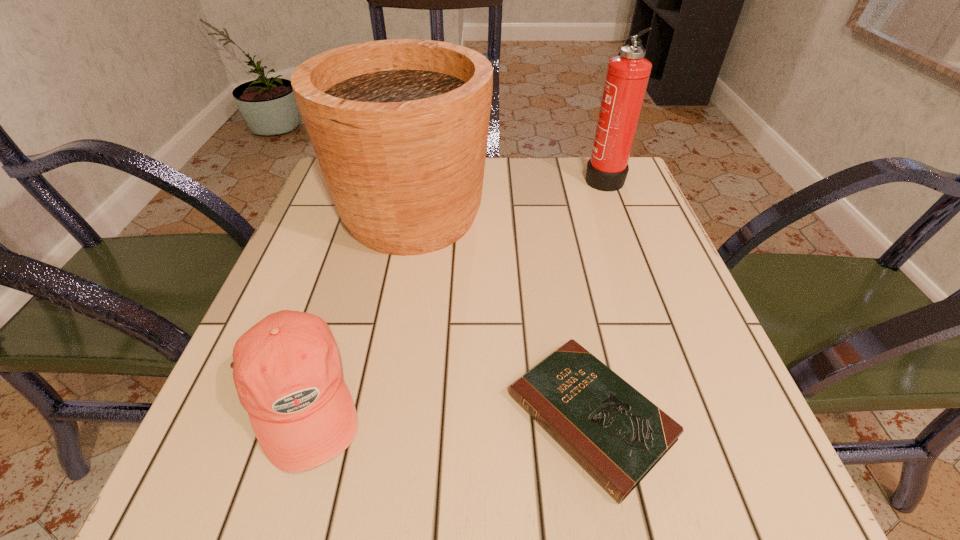
At what (x,y) coordinates should I click in order to perform the action: click on fire extinguisher that is at the far edge. Please return your answer as a coordinate pair (x, y). This screenshot has height=540, width=960. Looking at the image, I should click on (627, 76).

Where is `flowerpot that is at the far edge`? The width and height of the screenshot is (960, 540). flowerpot that is at the far edge is located at coordinates (400, 127).

I want to click on baseball cap situated at the near edge, so click(286, 368).

At what (x,y) coordinates should I click in order to perform the action: click on Bible at the near edge. Please return your answer as a coordinate pair (x, y). The image size is (960, 540). Looking at the image, I should click on (617, 435).

Locate an element on the screen. The width and height of the screenshot is (960, 540). flowerpot present at the left edge is located at coordinates (400, 127).

The image size is (960, 540). I want to click on baseball cap present at the left edge, so click(x=286, y=368).

Locate an element on the screen. fire extinguisher present at the right edge is located at coordinates (627, 76).

Locate an element on the screen. This screenshot has height=540, width=960. Bible that is at the right edge is located at coordinates (617, 435).

Locate an element on the screen. object that is at the far left corner is located at coordinates (400, 127).

At what (x,y) coordinates should I click in order to perform the action: click on object present at the near left corner. Please return your answer as a coordinate pair (x, y). The height and width of the screenshot is (540, 960). Looking at the image, I should click on (286, 368).